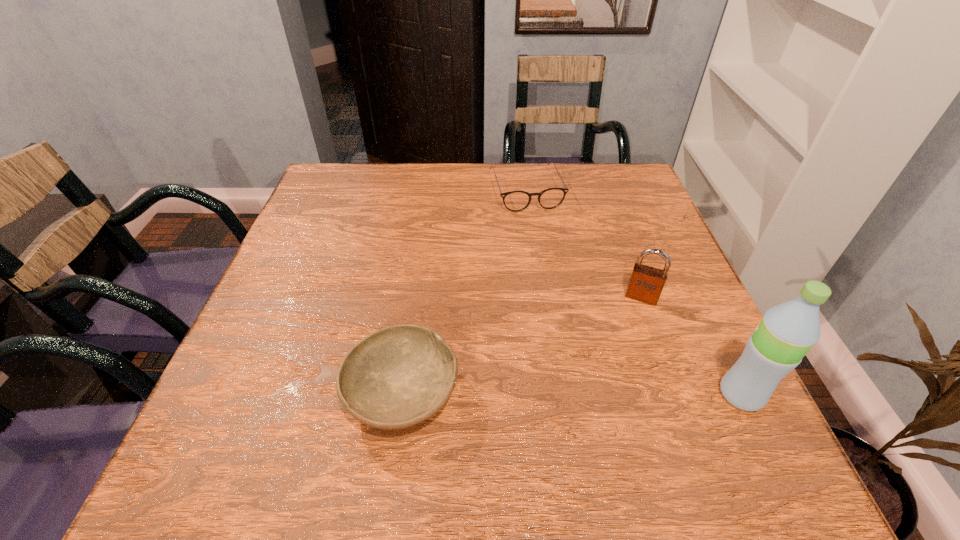
Find the location of a particular element. The image size is (960, 540). free space in the image that satisfies the following two spatial constraints: 1. on the back side of the leftmost object; 2. on the left side of the third object from left to right is located at coordinates (417, 297).